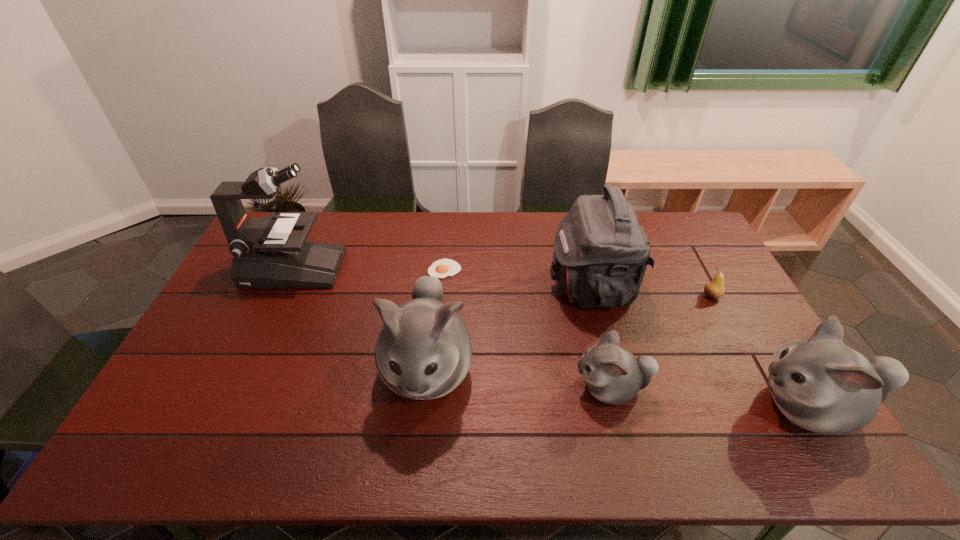
I want to click on vacant space located 0.360m on the right of the shortest object, so click(566, 269).

Identify the location of object present at the far edge. The width and height of the screenshot is (960, 540). (266, 254).

Locate an element on the screen. This screenshot has height=540, width=960. object that is at the left edge is located at coordinates (266, 254).

This screenshot has height=540, width=960. I want to click on hamster at the right edge, so click(x=822, y=385).

The image size is (960, 540). I want to click on pear positioned at the right edge, so click(x=714, y=289).

Find the location of a particular element. Image resolution: width=960 pixels, height=540 pixels. object that is at the far left corner is located at coordinates (266, 254).

The width and height of the screenshot is (960, 540). In order to click on object that is at the near right corner in this screenshot , I will do `click(822, 385)`.

In the image, there is a desktop. Identify the location of vacant space at the far edge. (543, 241).

Find the location of a particular element. Image resolution: width=960 pixels, height=540 pixels. vacant region at the near edge of the desktop is located at coordinates (717, 400).

Image resolution: width=960 pixels, height=540 pixels. Identify the location of free space at the left edge of the desktop. (195, 381).